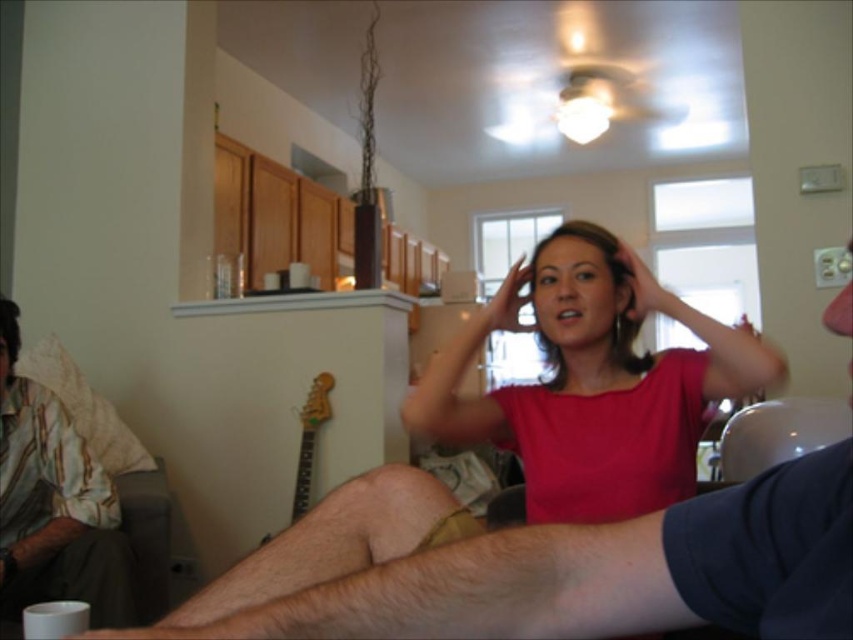
You are a delivery robot with a package that needs to be placed between the pink matte shirt at center and the striped cotton shirt at left. Can you fit the package there if it measures 1.1 meters in length?

The distance between the pink matte shirt at center and the striped cotton shirt at left is 1.08 meters, which is shorter than the package length of 1.1 meters. Therefore, the package cannot fit in the space between them.

You are standing in the room and want to reach both the point at coordinates (640, 476) and the point at coordinates (3, 557). Which point is closer to you?

The point at coordinates (640, 476) is closer to you than the point at coordinates (3, 557).